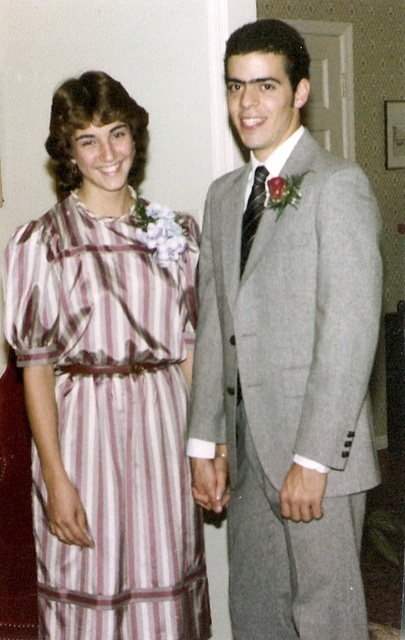
Who is taller, gray wool suit at center or striped silk dress at left?

gray wool suit at center

Which is above, gray wool suit at center or striped silk dress at left?

gray wool suit at center is higher up.

Which is in front, point (302, 186) or point (100, 520)?

Positioned in front is point (302, 186).

The width and height of the screenshot is (405, 640). Identify the location of gray wool suit at center. (285, 356).